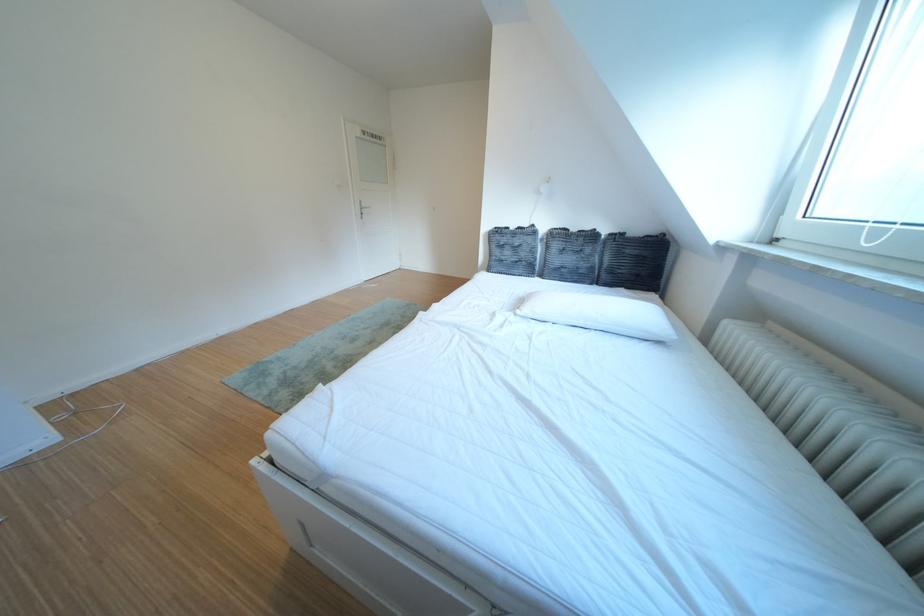
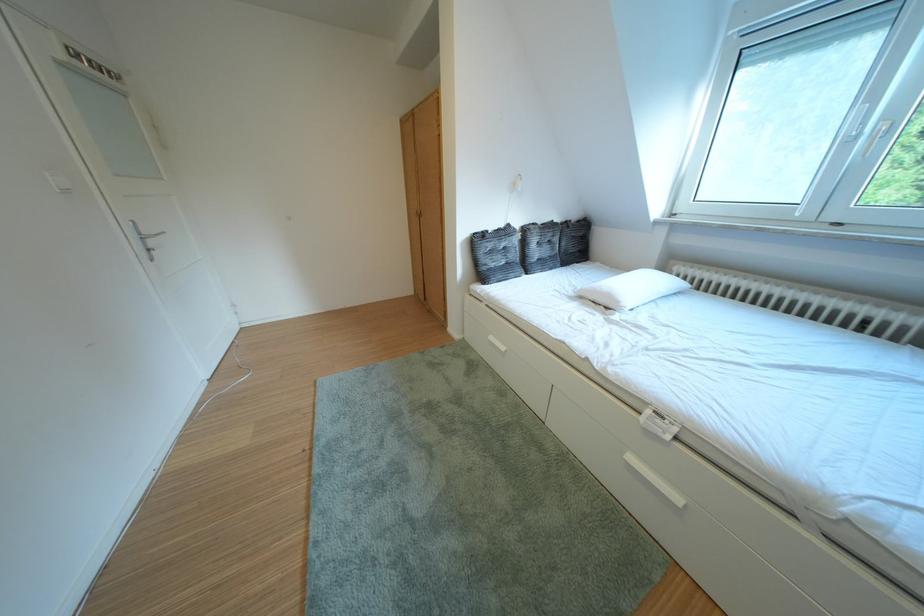
Find the pixel in the second image that matches (x=546, y=232) in the first image.

(523, 230)